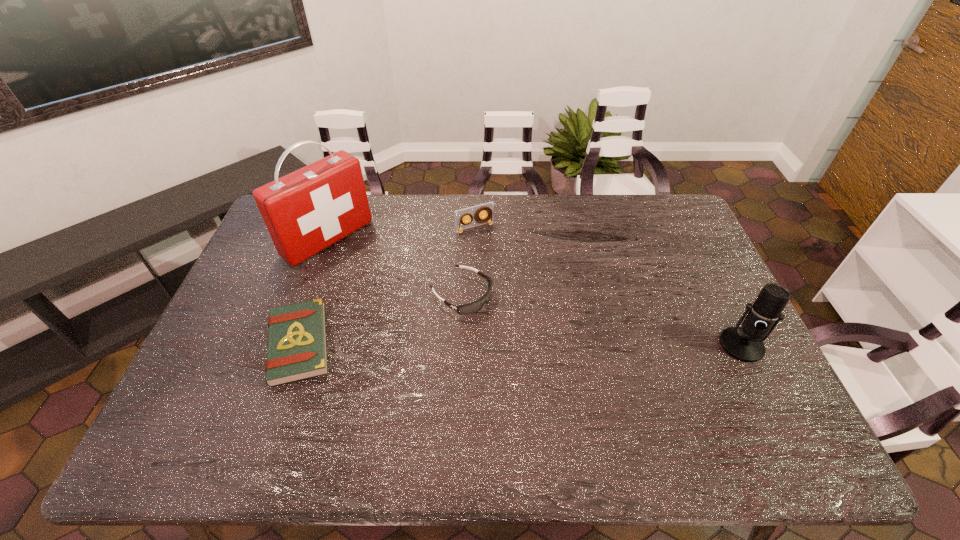
Identify the location of blank space located on the front and sides of the second shortest object. The width and height of the screenshot is (960, 540). [x=551, y=350].

What are the coordinates of `vacant space located on the front face of the first-aid kit` in the screenshot? It's located at (379, 279).

Locate an element on the screen. The width and height of the screenshot is (960, 540). vacant area located on the front face of the first-aid kit is located at coordinates (420, 311).

In order to click on free point located 0.400m on the front face of the first-aid kit in this screenshot , I will do `click(436, 323)`.

Where is `free space located 0.090m at the front of the third shortest object with visible reels`? This screenshot has width=960, height=540. free space located 0.090m at the front of the third shortest object with visible reels is located at coordinates (492, 250).

You are a GUI agent. You are given a task and a screenshot of the screen. Output one action in this format:
    pyautogui.click(x=<x>, y=<y>)
    Task: Click on the free space located 0.300m at the front of the third shortest object with visible reels
    The height and width of the screenshot is (540, 960).
    Given the screenshot: What is the action you would take?
    pyautogui.click(x=520, y=293)

I want to click on vacant area located at the front of the third shortest object with visible reels, so click(x=511, y=278).

I want to click on the first-aid kit located at the far edge, so click(x=306, y=211).

This screenshot has height=540, width=960. Identify the location of videotape present at the far edge. (487, 209).

Image resolution: width=960 pixels, height=540 pixels. I want to click on object positioned at the near edge, so click(x=297, y=346).